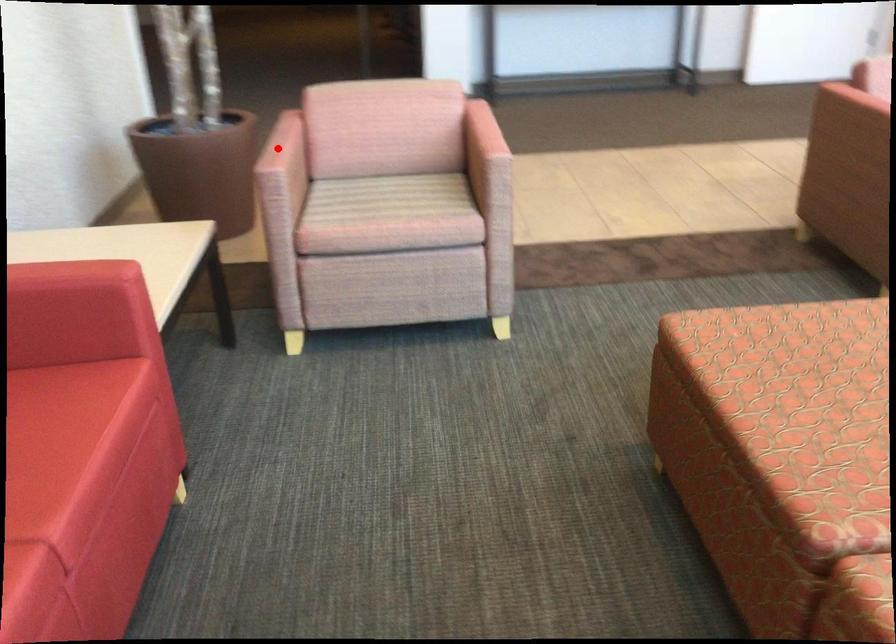
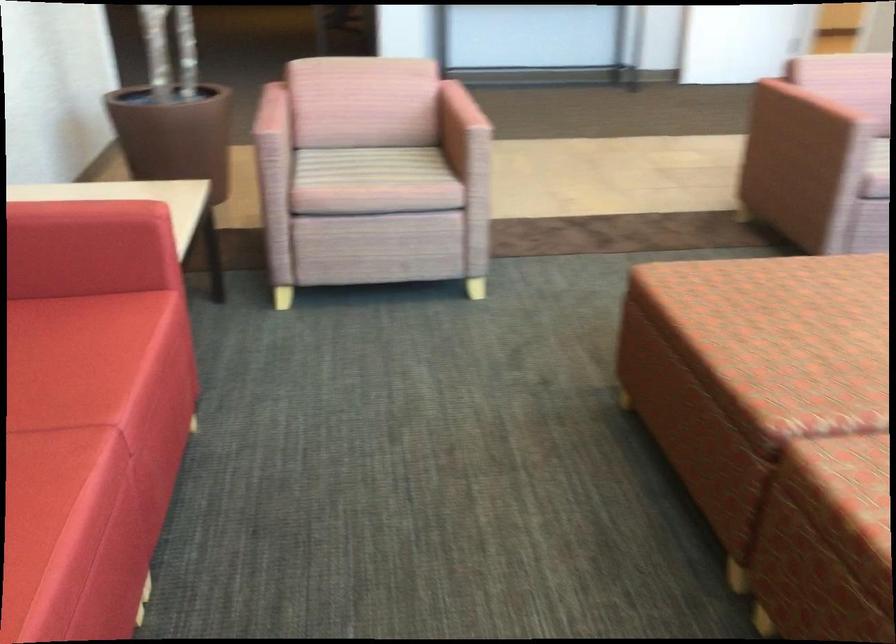
In the second image, find the point that corresponds to the highlighted location in the first image.

(271, 113)